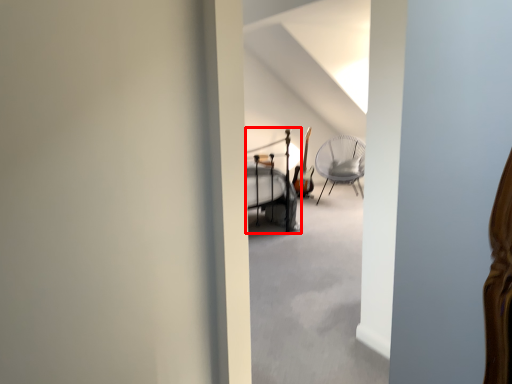
Question: From the image's perspective, considering the relative positions of bunk bed (annotated by the red box) and chair in the image provided, where is bunk bed (annotated by the red box) located with respect to the staircase?

Choices:
 (A) below
 (B) above

Answer: (A)